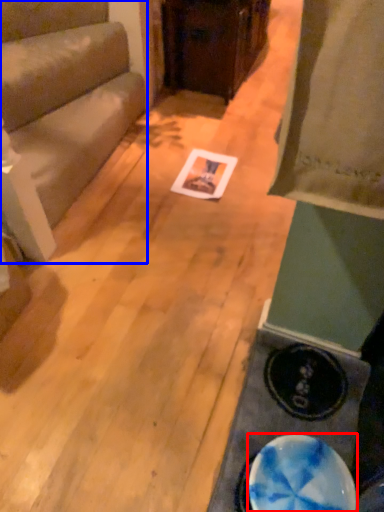
Question: Which object is further to the camera taking this photo, plate (highlighted by a red box) or furniture (highlighted by a blue box)?

Choices:
 (A) plate
 (B) furniture

Answer: (B)